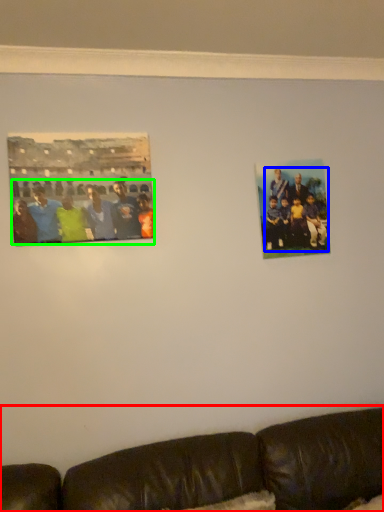
Question: Estimate the real-world distances between objects in this image. Which object is closer to studio couch (highlighted by a red box), person (highlighted by a blue box) or person (highlighted by a green box)?

Choices:
 (A) person
 (B) person

Answer: (A)